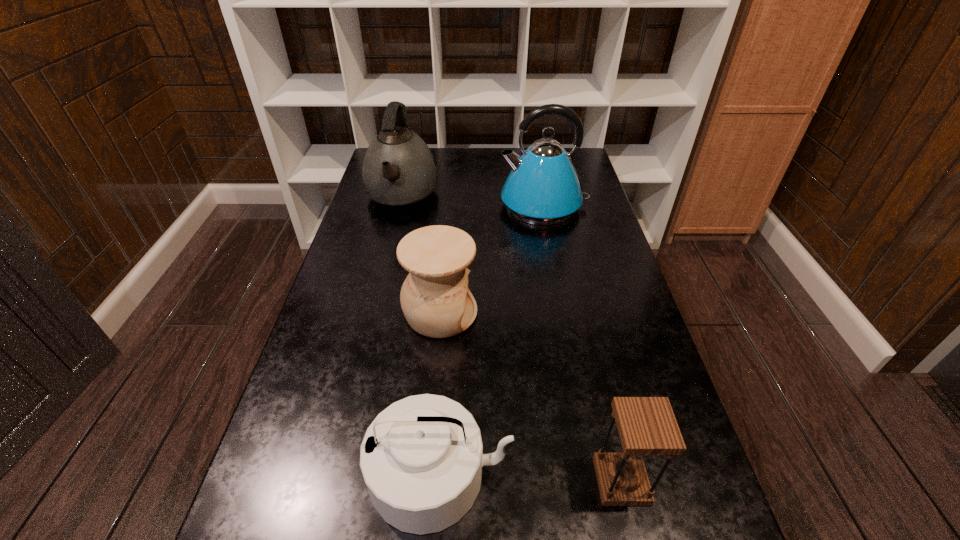
Select which object is the closest to the rightmost kettle. Please provide its 2D coordinates. Your answer should be formatted as a tuple, i.e. [(x, y)], where the tuple contains the x and y coordinates of a point satisfying the conditions above.

[(399, 173)]

Locate which object ranks third in proximity to the pottery. Please provide its 2D coordinates. Your answer should be formatted as a tuple, i.e. [(x, y)], where the tuple contains the x and y coordinates of a point satisfying the conditions above.

[(399, 173)]

Identify the location of kettle that is the closest to the nearest kettle. The image size is (960, 540). (543, 188).

Locate which kettle ranks third in proximity to the hourglass. Please provide its 2D coordinates. Your answer should be formatted as a tuple, i.e. [(x, y)], where the tuple contains the x and y coordinates of a point satisfying the conditions above.

[(399, 173)]

At what (x,y) coordinates should I click in order to perform the action: click on free space that satisfies the following two spatial constraints: 1. at the spout of the rightmost kettle; 2. on the spout of the nearest kettle. Please return your answer as a coordinate pair (x, y). Image resolution: width=960 pixels, height=540 pixels. Looking at the image, I should click on (596, 474).